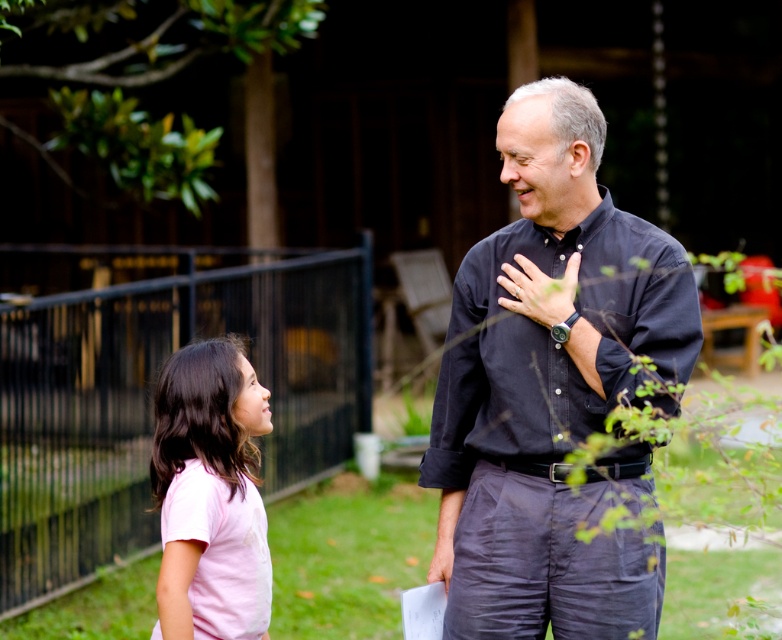
You are a photographer trying to capture a clear shot of the dark blue shirt at center and the matte black watch at center. Since you want both objects to be visible, which one should you focus on first?

The dark blue shirt at center is in front of the matte black watch at center, so you should focus on the dark blue shirt at center first to ensure both are in focus.

You are a tailor who needs to compare the sizes of two shirts in the image. The first is the dark blue shirt at center and the second is the pink cotton shirt at lower left. Which shirt has a greater width?

The dark blue shirt at center has a greater width than the pink cotton shirt at lower left.

Consider the image. You are standing in the backyard and see two points marked in the image. Which point is closer to you, point [486,317] or point [170,628]?

Point [486,317] is closer to you because it is further to the viewer than point [170,628].